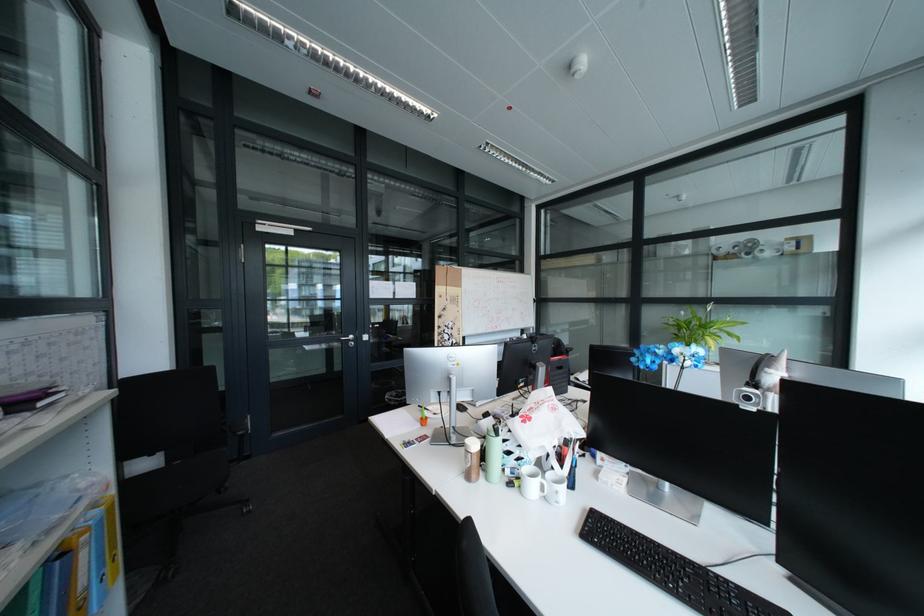
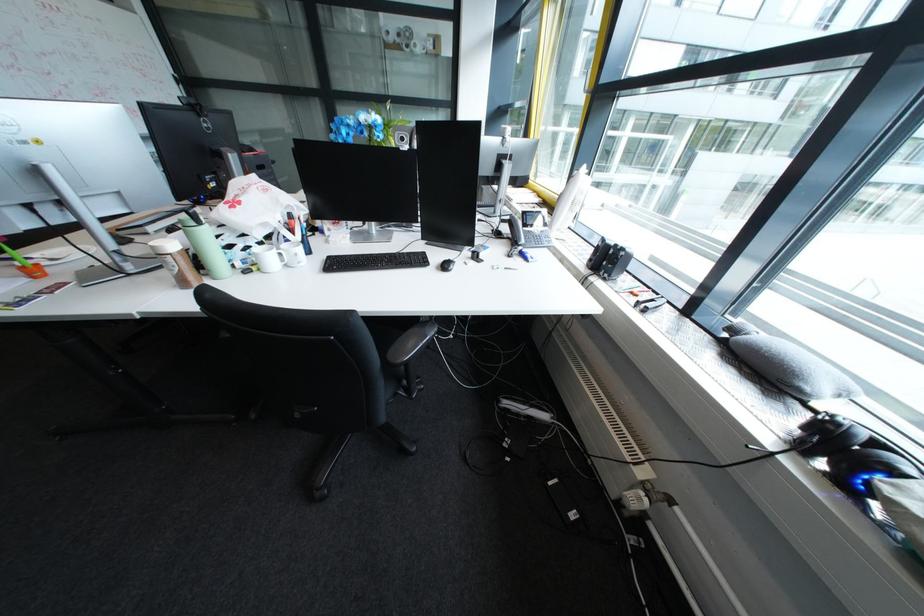
Based on the continuous images, in which direction is the camera rotating?

The camera's rotation is toward right-down.